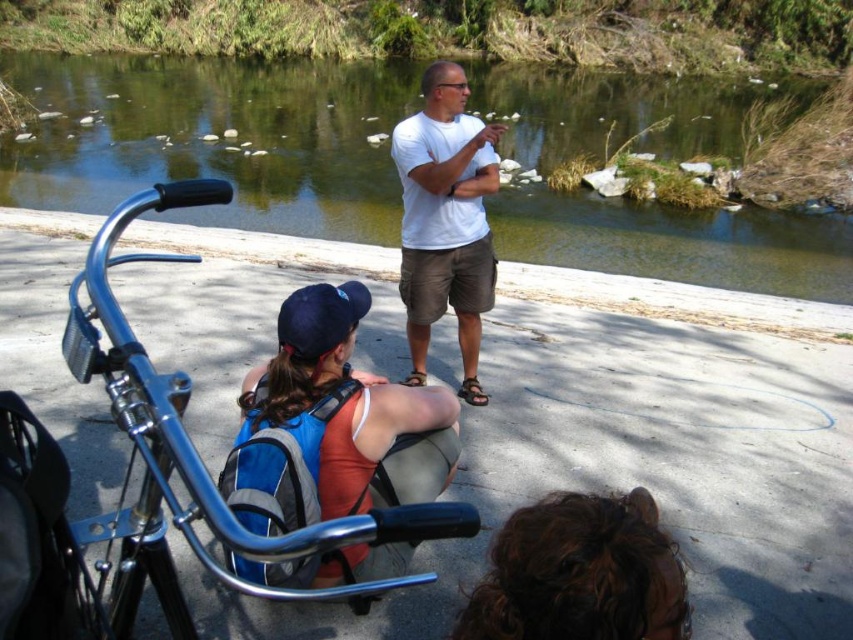
Question: Does shiny metallic bicycle at lower left appear on the left side of blue fabric backpack at lower left?

Choices:
 (A) no
 (B) yes

Answer: (B)

Question: Which point is closer to the camera?

Choices:
 (A) blue fabric backpack at lower left
 (B) green water at upper center

Answer: (A)

Question: Which of the following is the farthest from the observer?

Choices:
 (A) blue fabric backpack at lower left
 (B) shiny metallic bicycle at lower left

Answer: (A)

Question: Can you confirm if green water at upper center is bigger than shiny metallic bicycle at lower left?

Choices:
 (A) no
 (B) yes

Answer: (B)

Question: Is blue fabric backpack at lower left wider than white cotton shirt at center?

Choices:
 (A) yes
 (B) no

Answer: (A)

Question: Estimate the real-world distances between objects in this image. Which object is closer to the blue fabric backpack at lower left?

Choices:
 (A) green water at upper center
 (B) white cotton shirt at center
 (C) shiny metallic bicycle at lower left

Answer: (C)